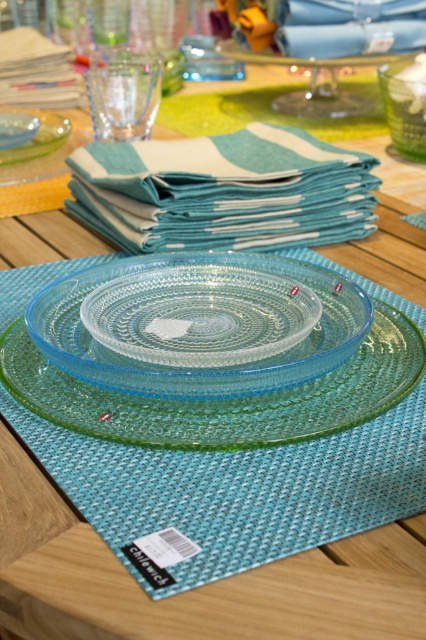
Does transparent glass platter at center appear over green textured glass bowl at upper right?

Actually, transparent glass platter at center is below green textured glass bowl at upper right.

Who is higher up, transparent glass platter at center or green textured glass bowl at upper right?

green textured glass bowl at upper right is higher up.

What do you see at coordinates (224, 397) in the screenshot? I see `transparent glass platter at center` at bounding box center [224, 397].

Image resolution: width=426 pixels, height=640 pixels. Identify the location of transparent glass platter at center. 224,397.

Based on the photo, does transparent glass platter at center lie behind transparent glass plate at center?

No, it is not.

Consider the image. How distant is transparent glass platter at center from transparent glass plate at center?

A distance of 1.21 inches exists between transparent glass platter at center and transparent glass plate at center.

Locate an element on the screen. transparent glass platter at center is located at coordinates (224, 397).

Does teal woven cloth at upper center have a greater width compared to transparent glass plate at upper left?

Yes.

Does teal woven cloth at upper center come behind transparent glass plate at upper left?

No, teal woven cloth at upper center is in front of transparent glass plate at upper left.

What do you see at coordinates (224, 189) in the screenshot? I see `teal woven cloth at upper center` at bounding box center [224, 189].

Image resolution: width=426 pixels, height=640 pixels. I want to click on teal woven cloth at upper center, so click(224, 189).